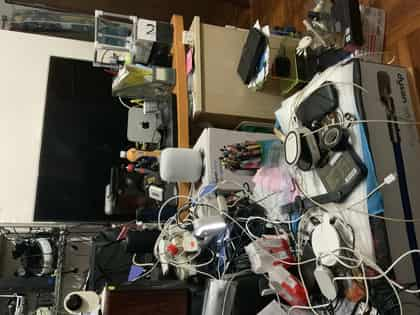
This screenshot has height=315, width=420. I want to click on usb cable on right of image, so click(391, 178).